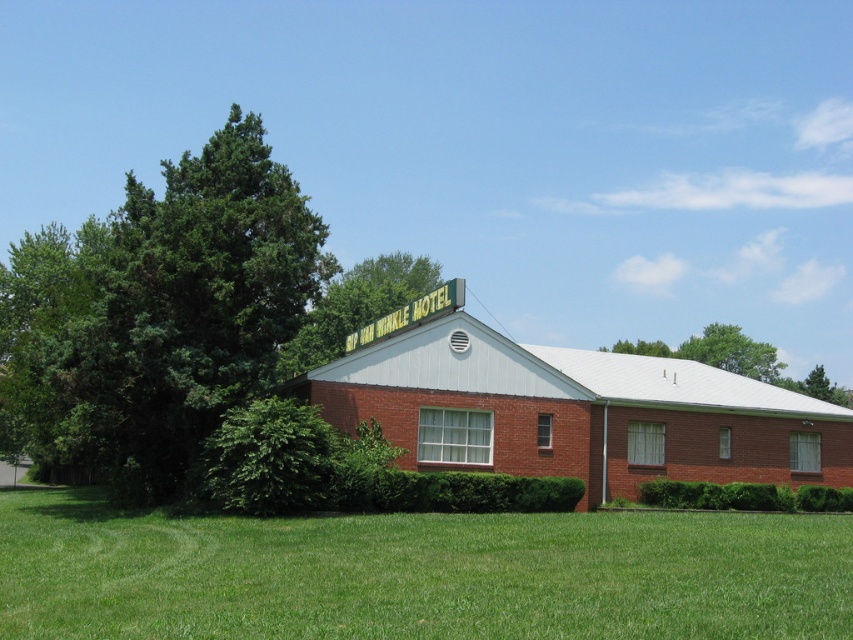
You are standing at the point marked as point (x=416, y=573) in the image. Looking towards the motel building, what is directly in front of you?

The point (x=416, y=573) corresponds to green grass at lower center, so directly in front of you is the green grass at lower center.

You are standing in front of the motel and want to walk from the green grass at lower center to the green leafy tree at left. Which direction should you head to reach the tree?

The green grass at lower center is in front of the green leafy tree at left, so to reach the tree, you should walk towards the left from the green grass at lower center.

You are standing in front of the motel and want to walk from the green leafy bush at lower left to the green leafy tree at upper center. Which direction should you head to move towards the tree?

You should move towards the upper center direction because the green leafy tree at upper center is further away from the viewer compared to the green leafy bush at lower left, so heading upwards would take you closer to the tree.